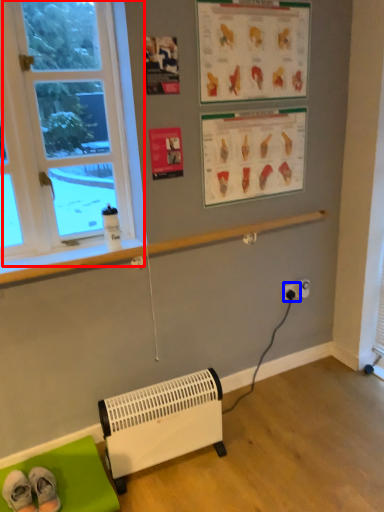
Question: Among these objects, which one is nearest to the camera, window (highlighted by a red box) or electric outlet (highlighted by a blue box)?

Choices:
 (A) window
 (B) electric outlet

Answer: (A)